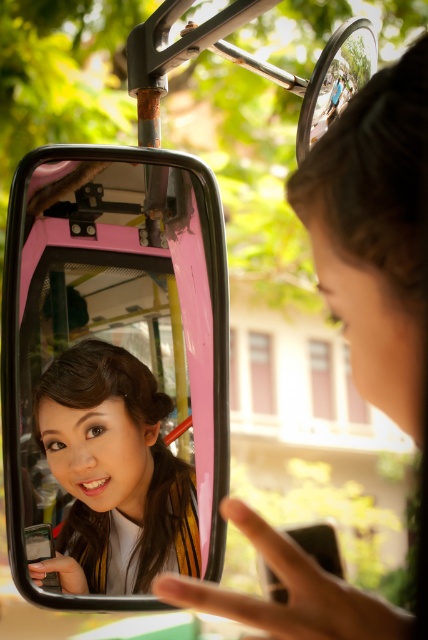
You are a passenger in the vehicle and want to know which of the two points, point (207, 435) or point (53, 380), is closer to the rear of the vehicle. Based on the reflection in the side mirror, can you determine which point is located closer to the back?

Point (207, 435) is behind point (53, 380), so it is closer to the rear of the vehicle.

Based on the photo, you are a passenger in a vehicle and notice the pink glossy rearview mirror at upper center and the matte black hair at center. Which object appears taller in the scene?

The pink glossy rearview mirror at upper center appears taller than the matte black hair at center.